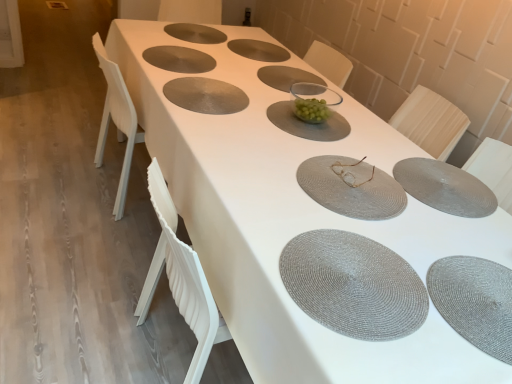
Question: Considering the positions of clear glass bowl at center, arranged as the 6th tableware when ordered from the bottom, and gray woven placemat at center in the image, is clear glass bowl at center, arranged as the 6th tableware when ordered from the bottom, wider or thinner than gray woven placemat at center?

Choices:
 (A) wide
 (B) thin

Answer: (B)

Question: From the image's perspective, relative to gray woven placemat at center, is clear glass bowl at center, arranged as the 6th tableware when ordered from the bottom, above or below?

Choices:
 (A) above
 (B) below

Answer: (B)

Question: Which object is the closest to the gray woven placemat at lower right, the 1th tableware from the bottom?

Choices:
 (A) green glass bowl at center, arranged as the 5th tableware when ordered from the bottom
 (B) matte gray placemat at upper center, which ranks as the eighth tableware in bottom-to-top order
 (C) matte gray placemat at upper center, the ninth tableware when ordered from bottom to top
 (D) gray woven placemat at center, the 8th tableware positioned from the top
 (E) gold metallic glasses at center, which is the fourth tableware from bottom to top

Answer: (D)

Question: Estimate the real-world distances between objects in this image. Which object is closer to the gray woven placemat at center?

Choices:
 (A) matte gray placemat at center, the seventh tableware when ordered from top to bottom
 (B) clear glass bowl at center, which ranks as the 4th tableware in top-to-bottom order
 (C) gray woven placemat at lower right, the 1th tableware from the bottom
 (D) gray woven placemat at center, the 8th tableware positioned from the top
 (E) gold metallic glasses at center, the 6th tableware when ordered from top to bottom

Answer: (C)